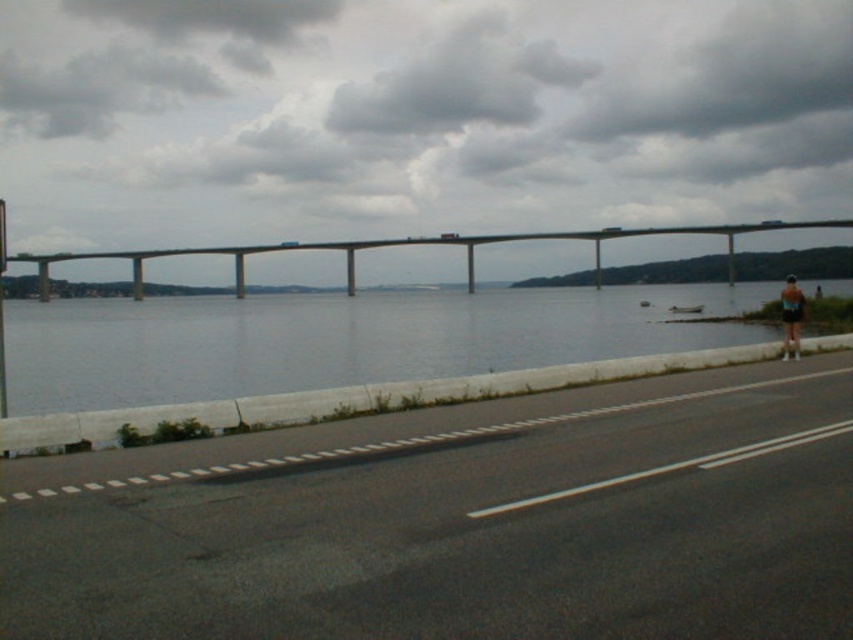
In the scene shown: You are a driver who needs to cross the concrete bridge at center. There is a metallic street sign at left nearby. Which object is bigger in the scene?

The concrete bridge at center is larger in size than the metallic street sign at left, so the concrete bridge at center is bigger.

You are standing at the point labeled point (758, 497) and want to walk to the point labeled point (192, 417). Which direction should you move relative to the camera?

You should move away from the camera because point (192, 417) is farther from the camera than point (758, 497).